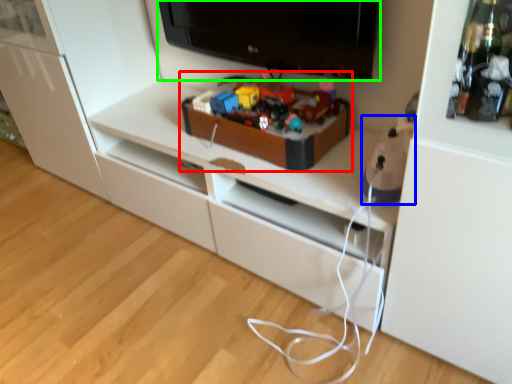
Question: Based on their relative distances, which object is nearer to toy (highlighted by a red box)? Choose from toy (highlighted by a blue box) and television (highlighted by a green box).

Choices:
 (A) toy
 (B) television

Answer: (B)